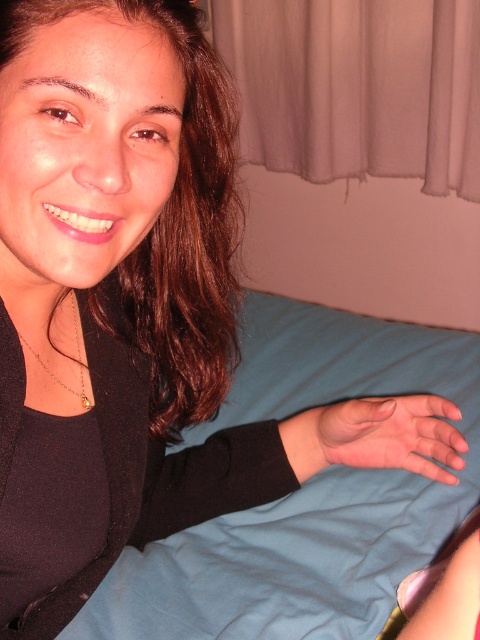
Which is above, blue fabric bed at center or gold chain necklace at left?

gold chain necklace at left is higher up.

Consider the image. Is the position of blue fabric bed at center more distant than that of gold chain necklace at left?

Yes, blue fabric bed at center is further from the viewer.

Locate an element on the screen. Image resolution: width=480 pixels, height=640 pixels. blue fabric bed at center is located at coordinates (303, 493).

Which is behind, point (394, 438) or point (84, 371)?

Positioned behind is point (394, 438).

Find the location of a particular element. pink smooth skin at center is located at coordinates (388, 435).

What are the coordinates of `pink smooth skin at center` in the screenshot? It's located at (388, 435).

Is point (399, 577) in front of point (416, 465)?

No, it is not.

Which is below, blue fabric bed at center or pink smooth skin at center?

blue fabric bed at center is lower down.

In order to click on blue fabric bed at center in this screenshot , I will do `click(303, 493)`.